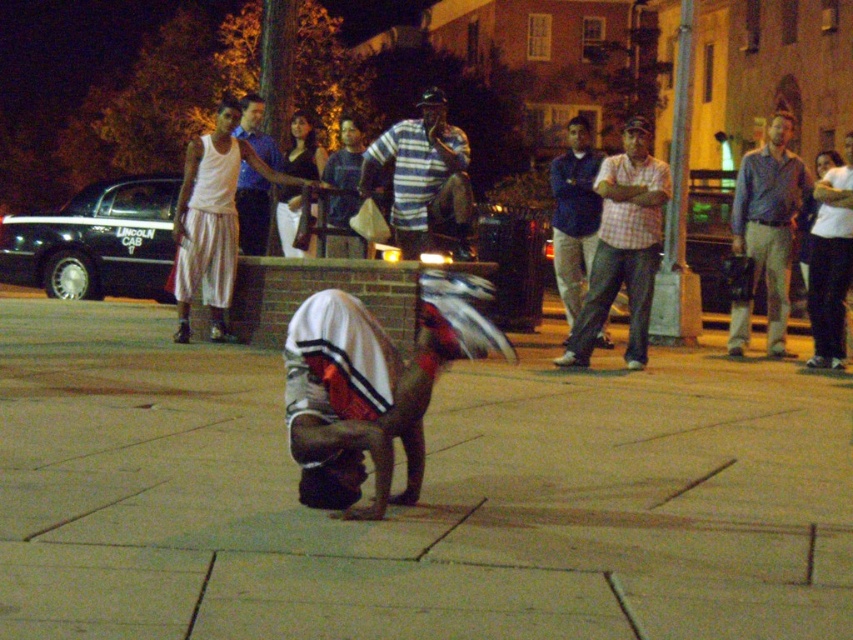
Looking at this image, is white fabric head at center to the left of white cotton tank top at upper left from the viewer's perspective?

In fact, white fabric head at center is to the right of white cotton tank top at upper left.

Is white fabric head at center to the right of white cotton tank top at upper left from the viewer's perspective?

Correct, you'll find white fabric head at center to the right of white cotton tank top at upper left.

Describe the element at coordinates (373, 387) in the screenshot. I see `white fabric head at center` at that location.

Identify the location of white fabric head at center. point(373,387).

What do you see at coordinates (212, 220) in the screenshot? I see `white cotton tank top at upper center` at bounding box center [212, 220].

Which is behind, point (193, 253) or point (788, 243)?

The point (788, 243) is behind.

Locate an element on the screen. white cotton tank top at upper center is located at coordinates (212, 220).

Can you confirm if brown concrete pavement at center is taller than blue denim jeans at center?

No, brown concrete pavement at center is not taller than blue denim jeans at center.

Does brown concrete pavement at center appear on the left side of blue denim jeans at center?

Yes, brown concrete pavement at center is to the left of blue denim jeans at center.

Image resolution: width=853 pixels, height=640 pixels. Describe the element at coordinates (421, 499) in the screenshot. I see `brown concrete pavement at center` at that location.

You are a GUI agent. You are given a task and a screenshot of the screen. Output one action in this format:
    pyautogui.click(x=<x>, y=<y>)
    Task: Click on the brown concrete pavement at center
    
    Given the screenshot: What is the action you would take?
    pyautogui.click(x=421, y=499)